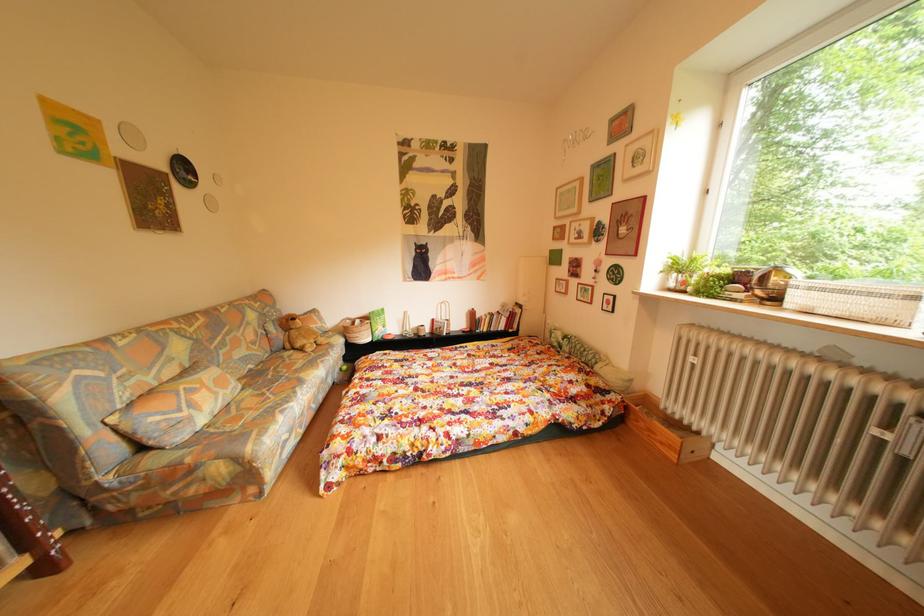
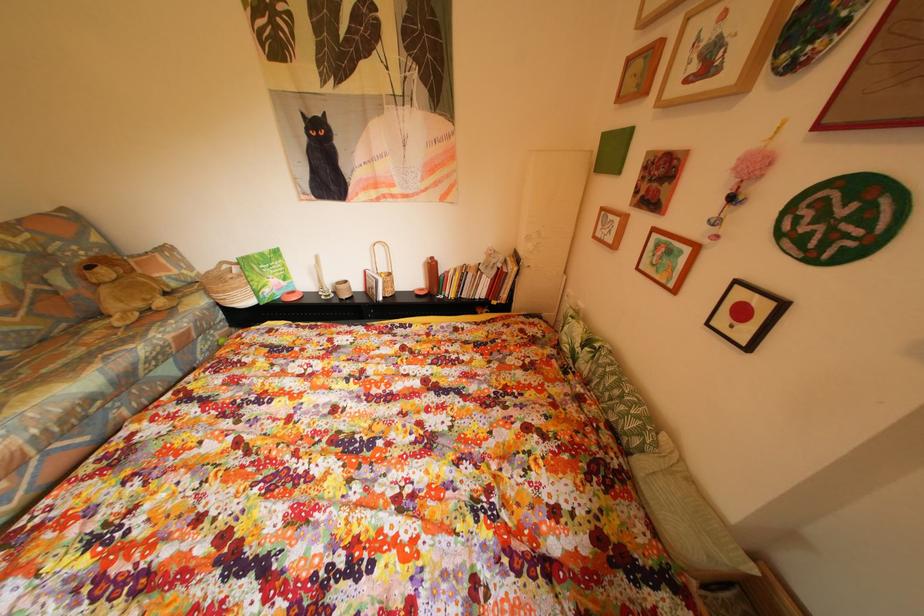
What movement of the cameraman would produce the second image?

The cameraman walked toward right, forward.